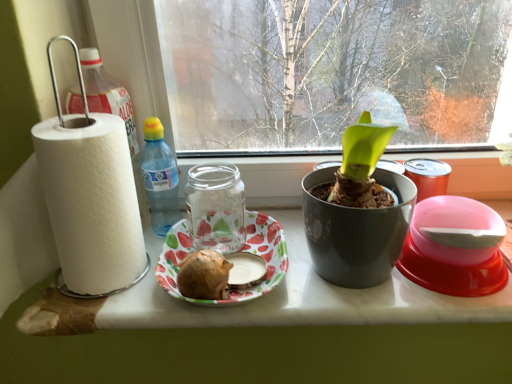
Find the location of `unoccupied region to the right of transparent glass jar at center`. unoccupied region to the right of transparent glass jar at center is located at coordinates (314, 261).